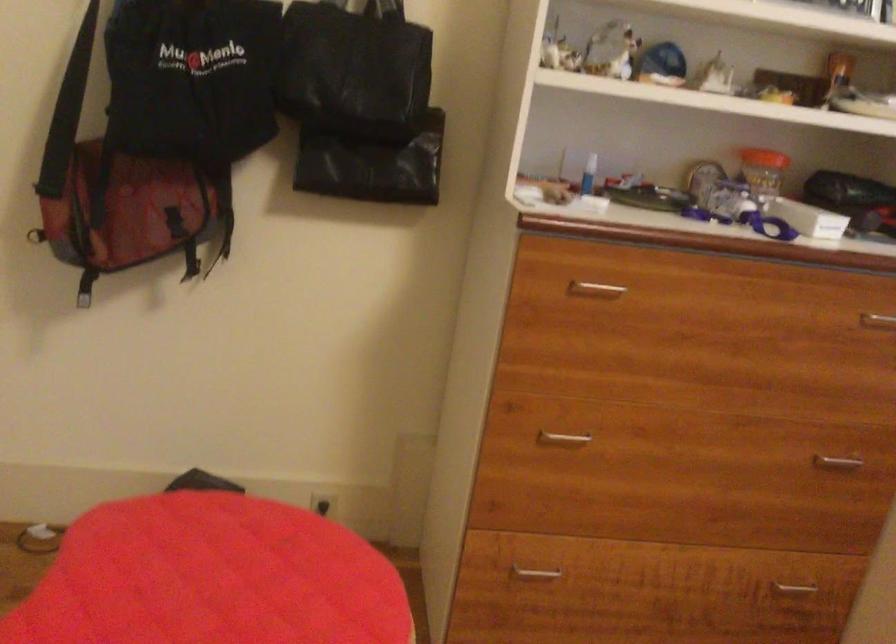
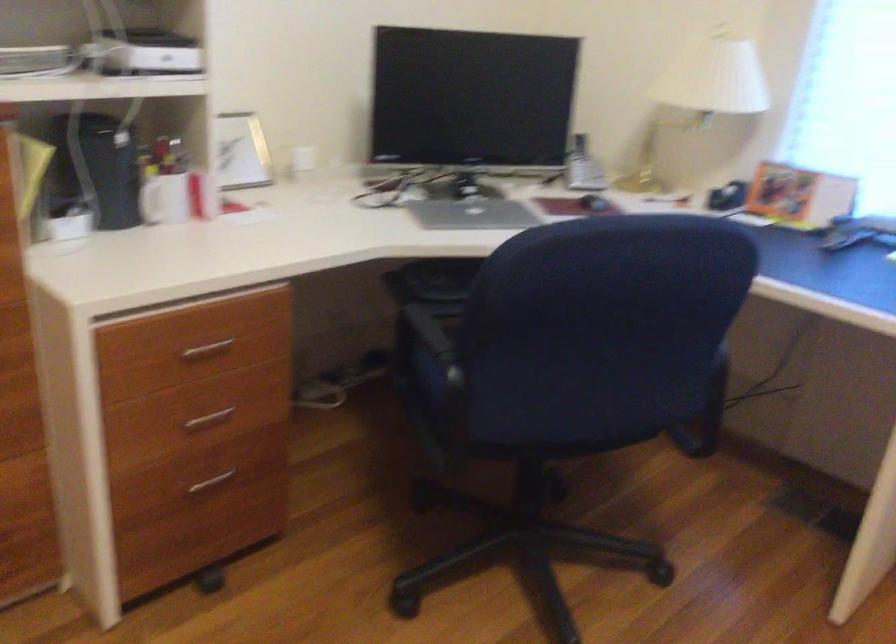
Question: The camera is either moving clockwise (left) or counter-clockwise (right) around the object. The first image is from the beginning of the video and the second image is from the end. Is the camera moving left or right when shooting the video?

Choices:
 (A) Left
 (B) Right

Answer: (A)